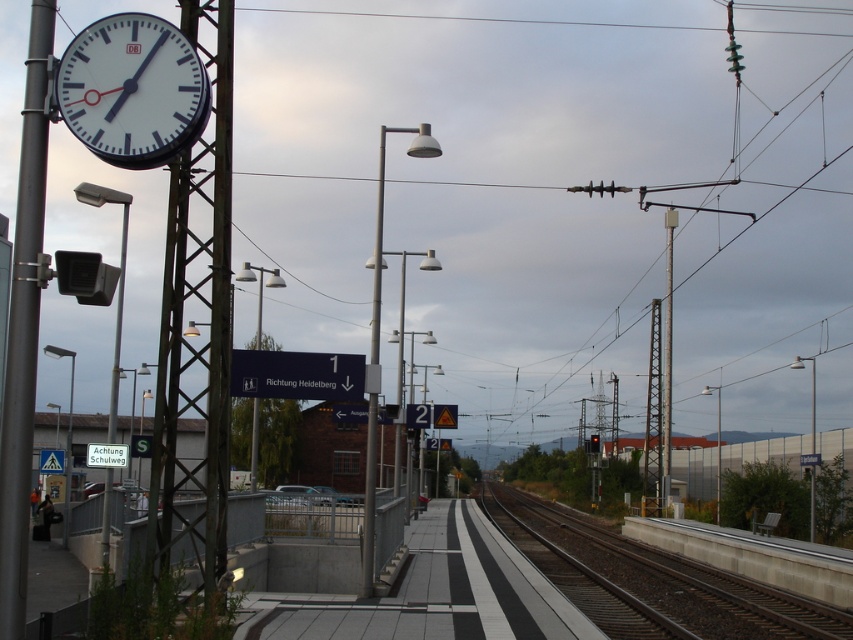
Question: Considering the real-world distances, which object is farthest from the metallic pole at left?

Choices:
 (A) white matte clock at upper left
 (B) metallic pole at center
 (C) metallic pole at center-right

Answer: (C)

Question: Where is metallic pole at center located in relation to metallic pole at center-right in the image?

Choices:
 (A) left
 (B) right

Answer: (A)

Question: Does white matte clock at upper left have a lesser width compared to metallic pole at left?

Choices:
 (A) yes
 (B) no

Answer: (A)

Question: Can you confirm if metallic pole at left is positioned above metallic pole at center-right?

Choices:
 (A) no
 (B) yes

Answer: (A)

Question: Which point appears farthest from the camera in this image?

Choices:
 (A) (10, 451)
 (B) (675, 221)
 (C) (173, 132)

Answer: (B)

Question: Considering the real-world distances, which object is closest to the white matte clock at upper left?

Choices:
 (A) metallic pole at center
 (B) metallic pole at center-right

Answer: (A)